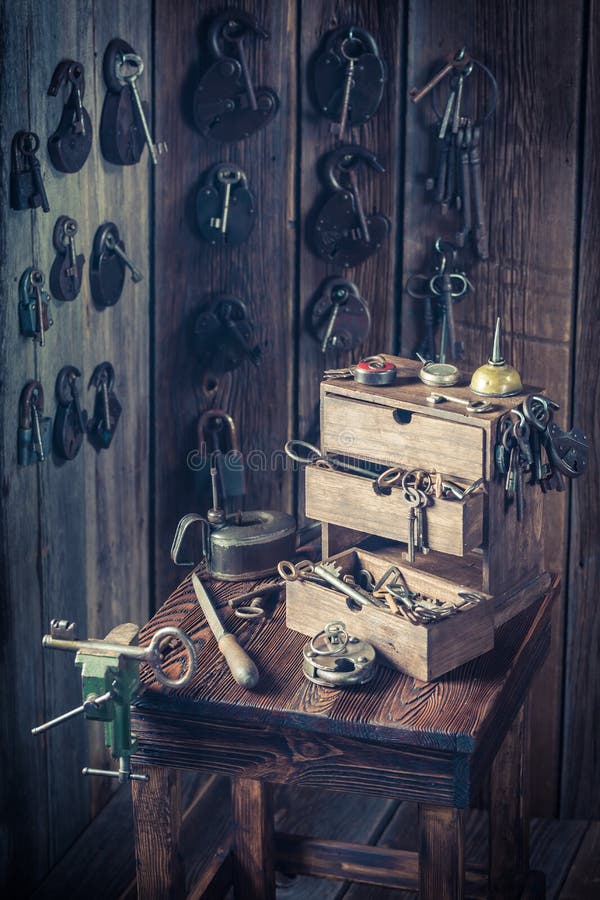
The image size is (600, 900). Find the location of `table surface`. table surface is located at coordinates (387, 694).